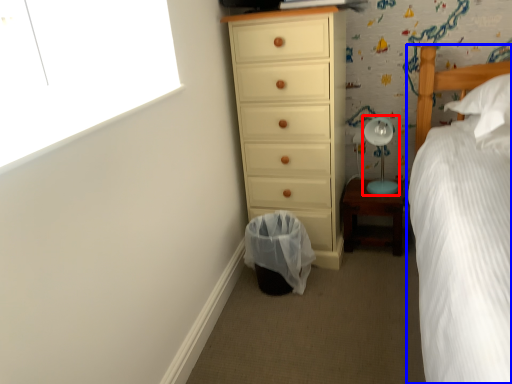
Question: Which object is further to the camera taking this photo, table lamp (highlighted by a red box) or bed (highlighted by a blue box)?

Choices:
 (A) table lamp
 (B) bed

Answer: (A)